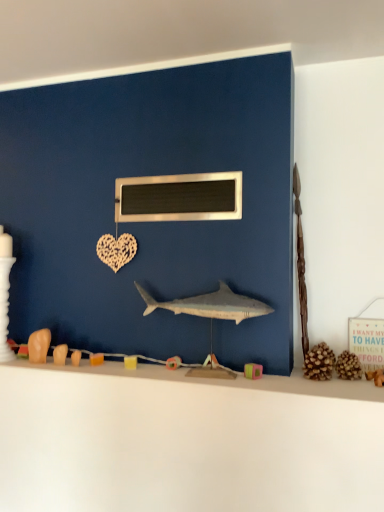
Question: From a real-world perspective, does white matte counter top at lower center stand above metallic rectangular object at center?

Choices:
 (A) no
 (B) yes

Answer: (A)

Question: Is white matte counter top at lower center smaller than metallic rectangular object at center?

Choices:
 (A) no
 (B) yes

Answer: (A)

Question: Is white matte counter top at lower center positioned in front of metallic rectangular object at center?

Choices:
 (A) no
 (B) yes

Answer: (B)

Question: Considering the relative positions of white matte counter top at lower center and metallic rectangular object at center in the image provided, is white matte counter top at lower center to the left of metallic rectangular object at center from the viewer's perspective?

Choices:
 (A) yes
 (B) no

Answer: (A)

Question: Are white matte counter top at lower center and metallic rectangular object at center far apart?

Choices:
 (A) yes
 (B) no

Answer: (B)

Question: In terms of size, does blue matte wall at center appear bigger or smaller than metallic rectangular object at center?

Choices:
 (A) big
 (B) small

Answer: (A)

Question: Based on their positions, is blue matte wall at center located to the left or right of metallic rectangular object at center?

Choices:
 (A) left
 (B) right

Answer: (A)

Question: Considering the positions of blue matte wall at center and metallic rectangular object at center in the image, is blue matte wall at center taller or shorter than metallic rectangular object at center?

Choices:
 (A) tall
 (B) short

Answer: (A)

Question: Does point (34, 180) appear closer or farther from the camera than point (180, 219)?

Choices:
 (A) farther
 (B) closer

Answer: (A)

Question: From a real-world perspective, is metallic rectangular object at center above or below smooth gray shark at center?

Choices:
 (A) below
 (B) above

Answer: (B)

Question: Is metallic rectangular object at center bigger or smaller than smooth gray shark at center?

Choices:
 (A) small
 (B) big

Answer: (A)

Question: Is metallic rectangular object at center wider or thinner than smooth gray shark at center?

Choices:
 (A) wide
 (B) thin

Answer: (B)

Question: Do you think metallic rectangular object at center is within smooth gray shark at center, or outside of it?

Choices:
 (A) outside
 (B) inside

Answer: (A)

Question: Does point (269, 476) appear closer or farther from the camera than point (188, 183)?

Choices:
 (A) farther
 (B) closer

Answer: (B)

Question: From a real-world perspective, is white matte counter top at lower center physically located above or below metallic rectangular object at center?

Choices:
 (A) above
 (B) below

Answer: (B)